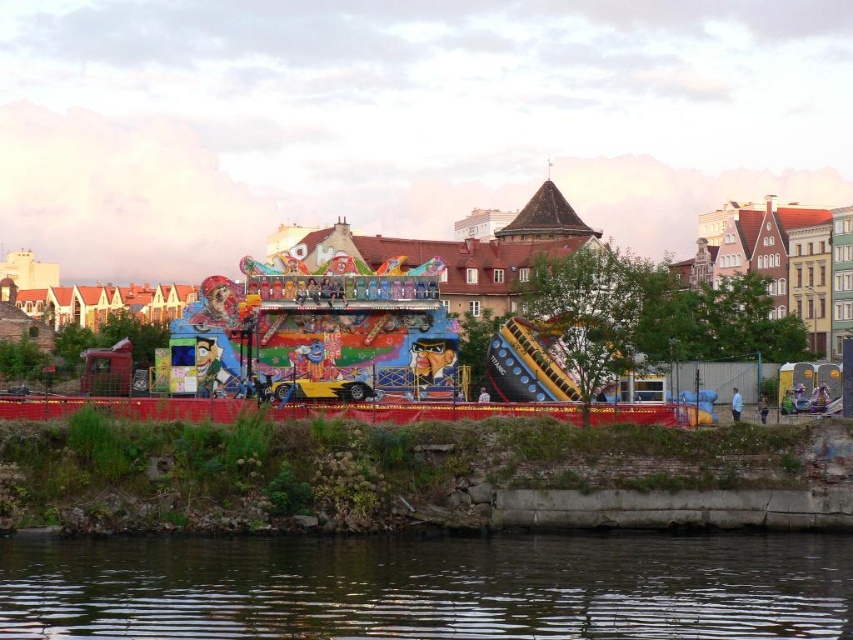
Does dark brown water at lower center appear over brick wall at lower center?

Incorrect, dark brown water at lower center is not positioned above brick wall at lower center.

Does dark brown water at lower center have a greater height compared to brick wall at lower center?

In fact, dark brown water at lower center may be shorter than brick wall at lower center.

Is point (428, 621) more distant than point (102, 444)?

No, (428, 621) is in front of (102, 444).

Identify the location of dark brown water at lower center. (428, 586).

Between point (148, 497) and point (392, 282), which one is positioned behind?

Point (392, 282)

Which is above, brick wall at lower center or colorful painted ride at center?

Positioned higher is colorful painted ride at center.

Which is behind, point (107, 506) or point (494, 381)?

Positioned behind is point (494, 381).

Identify the location of brick wall at lower center. (412, 468).

This screenshot has width=853, height=640. Identify the location of dark brown water at lower center. (428, 586).

Which is in front, point (479, 600) or point (547, 250)?

Positioned in front is point (479, 600).

In order to click on dark brown water at lower center in this screenshot , I will do `click(428, 586)`.